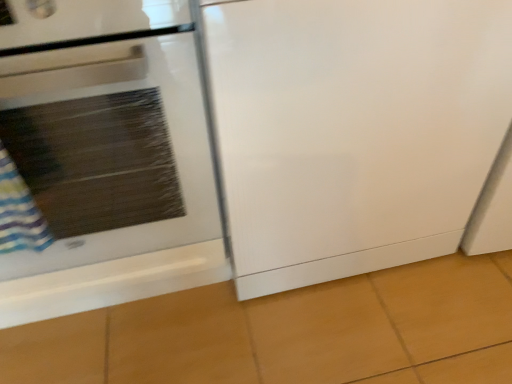
What do you see at coordinates (353, 130) in the screenshot? I see `white glossy refrigerator at center` at bounding box center [353, 130].

Locate an element on the screen. The height and width of the screenshot is (384, 512). white glossy refrigerator at center is located at coordinates (353, 130).

What is the approximate width of white glossy refrigerator at center?

The width of white glossy refrigerator at center is 61.14 centimeters.

Where is `white glossy oven at left`? white glossy oven at left is located at coordinates (108, 155).

Consider the image. What is the approximate width of white glossy oven at left?

The width of white glossy oven at left is 23.07 inches.

The image size is (512, 384). What do you see at coordinates (108, 155) in the screenshot? I see `white glossy oven at left` at bounding box center [108, 155].

Image resolution: width=512 pixels, height=384 pixels. Find the location of `white glossy refrigerator at center`. white glossy refrigerator at center is located at coordinates (353, 130).

Considering the relative positions of white glossy refrigerator at center and white glossy oven at left in the image provided, is white glossy refrigerator at center to the left or to the right of white glossy oven at left?

Clearly, white glossy refrigerator at center is on the right of white glossy oven at left in the image.

Considering the positions of objects white glossy refrigerator at center and white glossy oven at left in the image provided, who is behind, white glossy refrigerator at center or white glossy oven at left?

white glossy refrigerator at center is further from the camera.

Between point (440, 224) and point (5, 41), which one is positioned in front?

The point (5, 41) is closer.

From the image's perspective, which one is positioned lower, white glossy refrigerator at center or white glossy oven at left?

white glossy oven at left.

From a real-world perspective, which is physically below, white glossy refrigerator at center or white glossy oven at left?

white glossy refrigerator at center is physically lower.

Is white glossy refrigerator at center wider than white glossy oven at left?

Yes, white glossy refrigerator at center is wider than white glossy oven at left.

Is white glossy refrigerator at center taller or shorter than white glossy oven at left?

Clearly, white glossy refrigerator at center is shorter compared to white glossy oven at left.

Is white glossy refrigerator at center smaller than white glossy oven at left?

Yes, white glossy refrigerator at center is smaller than white glossy oven at left.

Is white glossy refrigerator at center inside the boundaries of white glossy oven at left, or outside?

white glossy refrigerator at center cannot be found inside white glossy oven at left.

Is white glossy refrigerator at center with white glossy oven at left?

They are not placed beside each other.

Could you tell me if white glossy refrigerator at center is turned towards white glossy oven at left?

No.

How different are the orientations of white glossy refrigerator at center and white glossy oven at left in degrees?

They differ by 0.917 degrees in their facing directions.

Image resolution: width=512 pixels, height=384 pixels. What are the coordinates of `screen door behind the white glossy oven at left` in the screenshot? It's located at (353, 130).

Which is more to the left, white glossy oven at left or white glossy refrigerator at center?

white glossy oven at left.

Is white glossy oven at left in front of or behind white glossy refrigerator at center in the image?

Clearly, white glossy oven at left is in front of white glossy refrigerator at center.

Considering the points (102, 253) and (313, 16), which point is behind, point (102, 253) or point (313, 16)?

The point (102, 253) is farther.

From the image's perspective, does white glossy oven at left appear lower than white glossy refrigerator at center?

Correct, white glossy oven at left appears lower than white glossy refrigerator at center in the image.

From a real-world perspective, who is located lower, white glossy oven at left or white glossy refrigerator at center?

white glossy refrigerator at center is physically lower.

Between white glossy oven at left and white glossy refrigerator at center, which one has larger width?

Wider between the two is white glossy refrigerator at center.

Can you confirm if white glossy oven at left is shorter than white glossy refrigerator at center?

No.

Is white glossy oven at left bigger or smaller than white glossy refrigerator at center?

Considering their sizes, white glossy oven at left takes up more space than white glossy refrigerator at center.

Is white glossy oven at left inside the boundaries of white glossy refrigerator at center, or outside?

white glossy oven at left is not inside white glossy refrigerator at center, it's outside.

Are white glossy oven at left and white glossy refrigerator at center making contact?

They are not placed beside each other.

Is white glossy oven at left turned away from white glossy refrigerator at center?

No, white glossy oven at left is not facing the opposite direction of white glossy refrigerator at center.

Can you tell me how much white glossy oven at left and white glossy refrigerator at center differ in facing direction?

There is a 0.917-degree angle between the facing directions of white glossy oven at left and white glossy refrigerator at center.

How far apart are white glossy oven at left and white glossy refrigerator at center?

9.95 inches.

Find the location of `screen door behind the white glossy oven at left`. screen door behind the white glossy oven at left is located at coordinates (353, 130).

Image resolution: width=512 pixels, height=384 pixels. In order to click on home appliance above the white glossy refrigerator at center (from a real-world perspective) in this screenshot , I will do `click(108, 155)`.

Locate an element on the screen. home appliance below the white glossy refrigerator at center (from the image's perspective) is located at coordinates (108, 155).